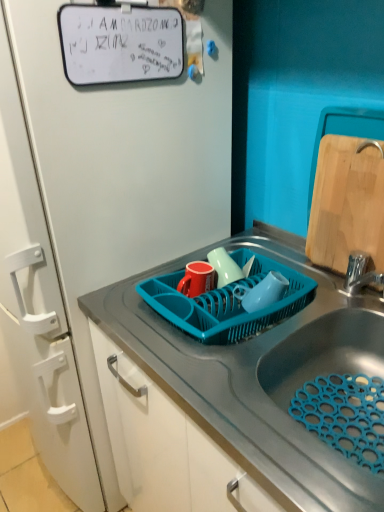
Measure the distance between wooden cutting board at right and camera.

The distance of wooden cutting board at right from camera is 36.11 inches.

Measure the distance between point (322, 218) and camera.

Point (322, 218) and camera are 1.06 meters apart.

Identify the location of wooden cutting board at right. (346, 204).

From the image's perspective, which is below, teal plastic dish rack at center or metallic sink at center?

metallic sink at center is shown below in the image.

Which is in front, teal plastic dish rack at center or metallic sink at center?

metallic sink at center is in front.

Which is closer to the camera, (165, 286) or (287, 337)?

Point (165, 286) is positioned farther from the camera compared to point (287, 337).

Is teal plastic dish rack at center smaller than metallic sink at center?

Yes, teal plastic dish rack at center is smaller than metallic sink at center.

From a real-world perspective, which is physically above, wooden cutting board at right or metallic sink at center?

From a 3D spatial view, wooden cutting board at right is above.

How different are the orientations of wooden cutting board at right and metallic sink at center in degrees?

2.33 degrees.

Considering the points (349, 239) and (344, 340), which point is behind, point (349, 239) or point (344, 340)?

The point (349, 239) is behind.

At what (x,y) coordinates should I click in order to perform the action: click on cutting board that appears above the metallic sink at center (from the image's perspective). Please return your answer as a coordinate pair (x, y). Looking at the image, I should click on (346, 204).

How many degrees apart are the facing directions of metallic sink at center and teal plastic dish rack at center?

metallic sink at center and teal plastic dish rack at center are facing 0.335 degrees away from each other.

Is metallic sink at center taller or shorter than teal plastic dish rack at center?

metallic sink at center is taller than teal plastic dish rack at center.

Does metallic sink at center have a larger size compared to teal plastic dish rack at center?

Yes.

Is metallic sink at center looking in the opposite direction of teal plastic dish rack at center?

No, teal plastic dish rack at center is not at the back of metallic sink at center.

How different are the orientations of metallic sink at center and wooden cutting board at right in degrees?

The angular difference between metallic sink at center and wooden cutting board at right is 2.33 degrees.

Consider the image. From a real-world perspective, relative to wooden cutting board at right, is metallic sink at center vertically above or below?

Clearly, from a real-world perspective, metallic sink at center is below wooden cutting board at right.

Between point (190, 369) and point (356, 192), which one is positioned in front?

The point (190, 369) is in front.

Considering the relative positions of metallic sink at center and wooden cutting board at right in the image provided, is metallic sink at center in front of wooden cutting board at right?

Yes, metallic sink at center is in front of wooden cutting board at right.

From a real-world perspective, who is located higher, teal plastic dish rack at center or wooden cutting board at right?

wooden cutting board at right.

Is teal plastic dish rack at center shorter than wooden cutting board at right?

Indeed, teal plastic dish rack at center has a lesser height compared to wooden cutting board at right.

Is teal plastic dish rack at center far away from wooden cutting board at right?

No, teal plastic dish rack at center is not far from wooden cutting board at right.

Consider the image. Is teal plastic dish rack at center inside wooden cutting board at right?

No, teal plastic dish rack at center is not surrounded by wooden cutting board at right.

Which of these two, wooden cutting board at right or teal plastic dish rack at center, stands taller?

With more height is wooden cutting board at right.

The image size is (384, 512). In order to click on basket below the wooden cutting board at right (from the image's perspective) in this screenshot , I will do `click(227, 302)`.

Does wooden cutting board at right lie behind teal plastic dish rack at center?

Yes, the depth of wooden cutting board at right is greater than that of teal plastic dish rack at center.

I want to click on sink that appears below the teal plastic dish rack at center (from the image's perspective), so click(x=232, y=397).

In order to click on sink below the wooden cutting board at right (from a real-world perspective) in this screenshot , I will do `click(232, 397)`.

Considering their positions, is teal plastic dish rack at center positioned further to wooden cutting board at right than metallic sink at center?

metallic sink at center is positioned further to the anchor wooden cutting board at right.

When comparing their distances from teal plastic dish rack at center, does metallic sink at center or wooden cutting board at right seem closer?

Among the two, metallic sink at center is located nearer to teal plastic dish rack at center.

Based on their spatial positions, is teal plastic dish rack at center or wooden cutting board at right further from metallic sink at center?

wooden cutting board at right is positioned further to the anchor metallic sink at center.

Looking at the image, which one is located closer to wooden cutting board at right, metallic sink at center or teal plastic dish rack at center?

teal plastic dish rack at center lies closer to wooden cutting board at right than the other object.

When comparing their distances from teal plastic dish rack at center, does wooden cutting board at right or metallic sink at center seem closer?

metallic sink at center is closer to teal plastic dish rack at center.

From the picture: When comparing their distances from metallic sink at center, does wooden cutting board at right or teal plastic dish rack at center seem closer?

The object closer to metallic sink at center is teal plastic dish rack at center.

Where is `basket between wooden cutting board at right and metallic sink at center vertically`? This screenshot has width=384, height=512. basket between wooden cutting board at right and metallic sink at center vertically is located at coordinates (227, 302).